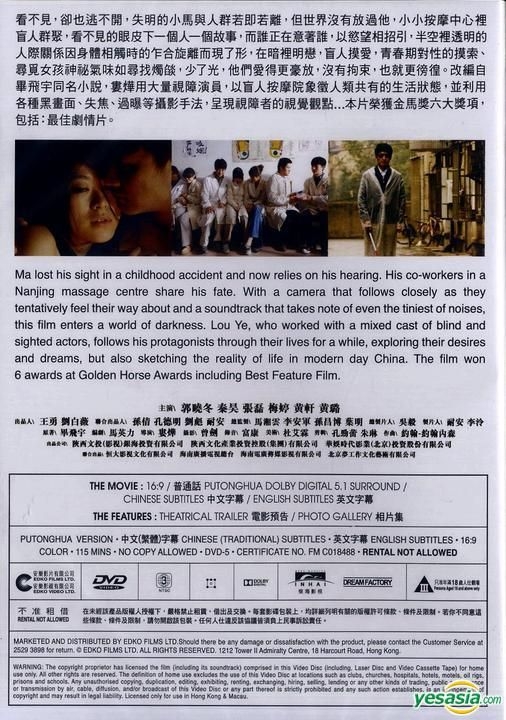
Locate an element on the screen. The image size is (506, 720). posters is located at coordinates (199, 142), (241, 148), (278, 148), (305, 148).